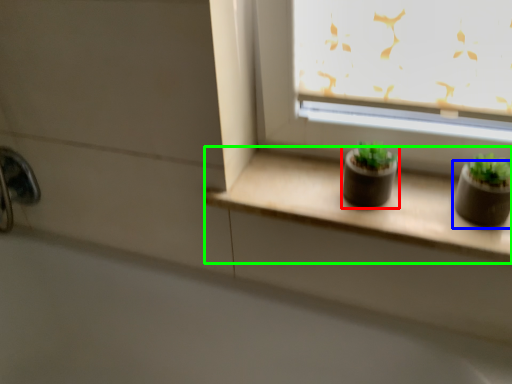
Question: Estimate the real-world distances between objects in this image. Which object is closer to flowerpot (highlighted by a red box), flowerpot (highlighted by a blue box) or window sill (highlighted by a green box)?

Choices:
 (A) flowerpot
 (B) window sill

Answer: (B)